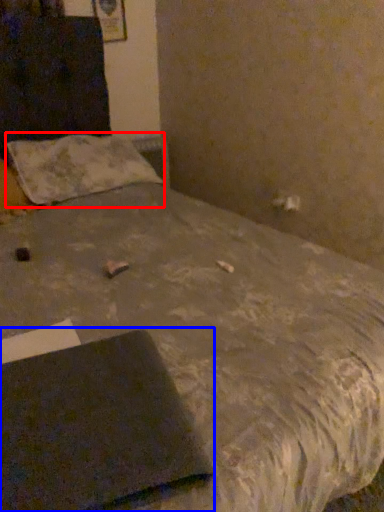
Question: Among these objects, which one is nearest to the camera, pillow (highlighted by a red box) or notebook (highlighted by a blue box)?

Choices:
 (A) pillow
 (B) notebook

Answer: (B)